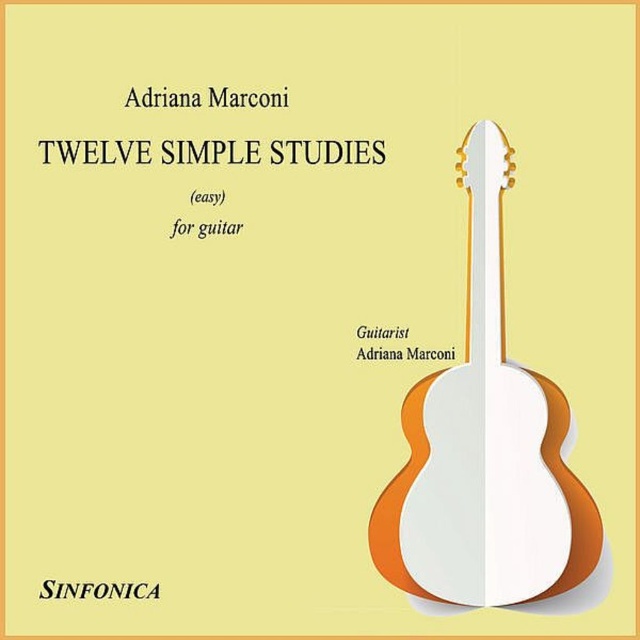
You are designing a layout for a music book cover and see the black text at upper center and the black paper at upper center. Which one is wider?

The black text at upper center is wider than the black paper at upper center according to the description.

You are designing a layout for a music book cover and notice the black text at upper center and the black paper at upper center. Which of these two elements is taller?

The black text at upper center is taller than the black paper at upper center.

Where is the red paper for guitar at center located in the image?

The red paper for guitar at center is located at point (204, 228).